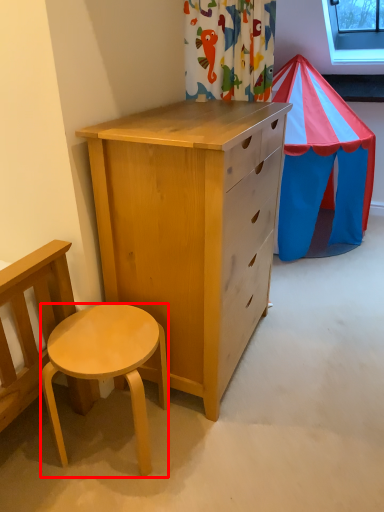
Question: Observing the image, what is the correct spatial positioning of desk (annotated by the red box) in reference to window screen?

Choices:
 (A) right
 (B) left

Answer: (B)